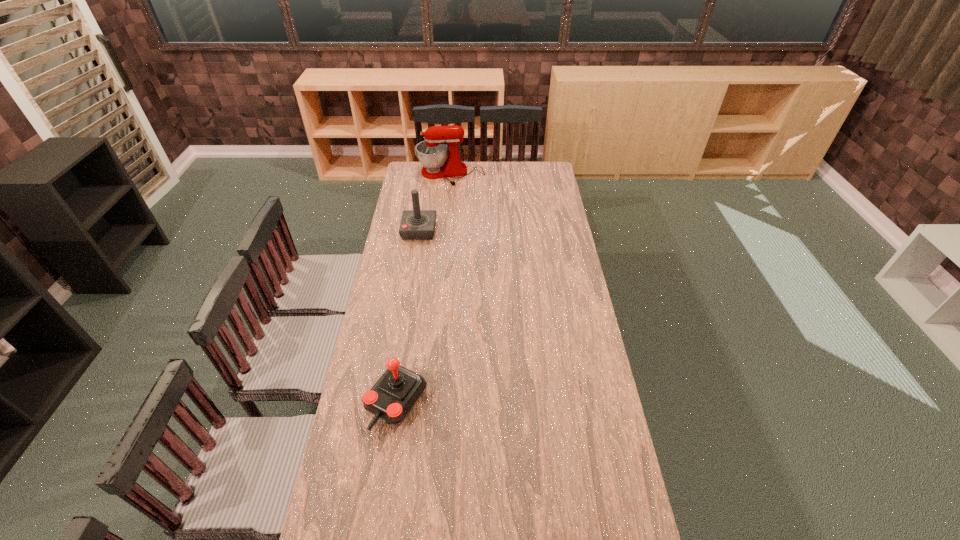
What are the coordinates of `vacant space at the far edge` in the screenshot? It's located at (525, 173).

Locate an element on the screen. vacant space at the left edge of the desktop is located at coordinates (x=418, y=281).

You are a GUI agent. You are given a task and a screenshot of the screen. Output one action in this format:
    pyautogui.click(x=<x>, y=<y>)
    Task: Click on the vacant space at the right edge of the desktop
    
    Given the screenshot: What is the action you would take?
    pyautogui.click(x=572, y=258)

In the image, there is a desktop. What are the coordinates of `free space at the far left corner` in the screenshot? It's located at (423, 166).

Find the location of `free space at the far right corner of the desktop`. free space at the far right corner of the desktop is located at coordinates (545, 167).

Locate an element on the screen. This screenshot has width=960, height=540. free space between the nearer joystick and the farther joystick is located at coordinates (408, 316).

The image size is (960, 540). I want to click on empty space between the nearer joystick and the second farthest object, so click(x=408, y=316).

Locate an element on the screen. The image size is (960, 540). unoccupied position between the tallest object and the nearest object is located at coordinates (423, 289).

Identify the location of empty space that is in between the farthest object and the second farthest object. (435, 202).

This screenshot has height=540, width=960. I want to click on vacant area that lies between the farthest object and the farther joystick, so click(435, 202).